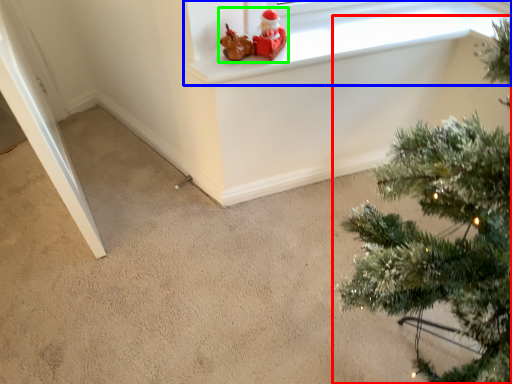
Question: Which is farther away from christmas tree (highlighted by a red box)? window frame (highlighted by a blue box) or toy (highlighted by a green box)?

Choices:
 (A) window frame
 (B) toy

Answer: (B)